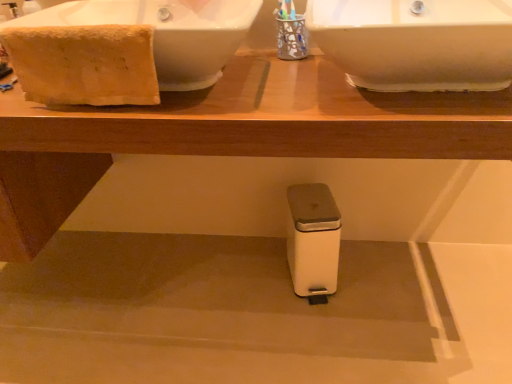
Question: Considering the relative sizes of white glossy sink at upper left, which is counted as the first sink, starting from the left, and white plastic table at center in the image provided, is white glossy sink at upper left, which is counted as the first sink, starting from the left, bigger than white plastic table at center?

Choices:
 (A) no
 (B) yes

Answer: (A)

Question: Does white glossy sink at upper left, which is counted as the first sink, starting from the left, come behind white plastic table at center?

Choices:
 (A) no
 (B) yes

Answer: (B)

Question: From a real-world perspective, is white glossy sink at upper left, which ranks as the 2th sink in right-to-left order, beneath white plastic table at center?

Choices:
 (A) no
 (B) yes

Answer: (A)

Question: Is white plastic table at center completely or partially inside white glossy sink at upper left, which ranks as the 2th sink in right-to-left order?

Choices:
 (A) yes
 (B) no

Answer: (B)

Question: Could you tell me if white glossy sink at upper left, which ranks as the 2th sink in right-to-left order, is facing white plastic table at center?

Choices:
 (A) no
 (B) yes

Answer: (A)

Question: Considering their positions, is white glossy sink at upper right, the 2th sink from the left, located in front of or behind white glossy sink at upper left, which is counted as the first sink, starting from the left?

Choices:
 (A) behind
 (B) front

Answer: (B)

Question: Based on their sizes in the image, would you say white glossy sink at upper right, the 2th sink from the left, is bigger or smaller than white glossy sink at upper left, which is counted as the first sink, starting from the left?

Choices:
 (A) big
 (B) small

Answer: (B)

Question: Is white glossy sink at upper right, acting as the first sink starting from the right, wider or thinner than white glossy sink at upper left, which is counted as the first sink, starting from the left?

Choices:
 (A) wide
 (B) thin

Answer: (B)

Question: From the image's perspective, is white glossy sink at upper right, acting as the first sink starting from the right, located above or below white glossy sink at upper left, which ranks as the 2th sink in right-to-left order?

Choices:
 (A) below
 (B) above

Answer: (A)

Question: From a real-world perspective, is beige cotton towel at upper left physically located above or below white glossy sink at upper right, the 2th sink from the left?

Choices:
 (A) above
 (B) below

Answer: (A)

Question: Visually, is beige cotton towel at upper left positioned to the left or to the right of white glossy sink at upper right, acting as the first sink starting from the right?

Choices:
 (A) left
 (B) right

Answer: (A)

Question: Relative to white glossy sink at upper right, acting as the first sink starting from the right, is beige cotton towel at upper left in front or behind?

Choices:
 (A) front
 (B) behind

Answer: (B)

Question: Considering the positions of beige cotton towel at upper left and white glossy sink at upper right, acting as the first sink starting from the right, in the image, is beige cotton towel at upper left bigger or smaller than white glossy sink at upper right, acting as the first sink starting from the right,?

Choices:
 (A) big
 (B) small

Answer: (B)

Question: From a real-world perspective, is beige cotton towel at upper left positioned above or below white glossy sink at upper left, which ranks as the 2th sink in right-to-left order?

Choices:
 (A) above
 (B) below

Answer: (A)

Question: Visually, is beige cotton towel at upper left positioned to the left or to the right of white glossy sink at upper left, which ranks as the 2th sink in right-to-left order?

Choices:
 (A) right
 (B) left

Answer: (B)